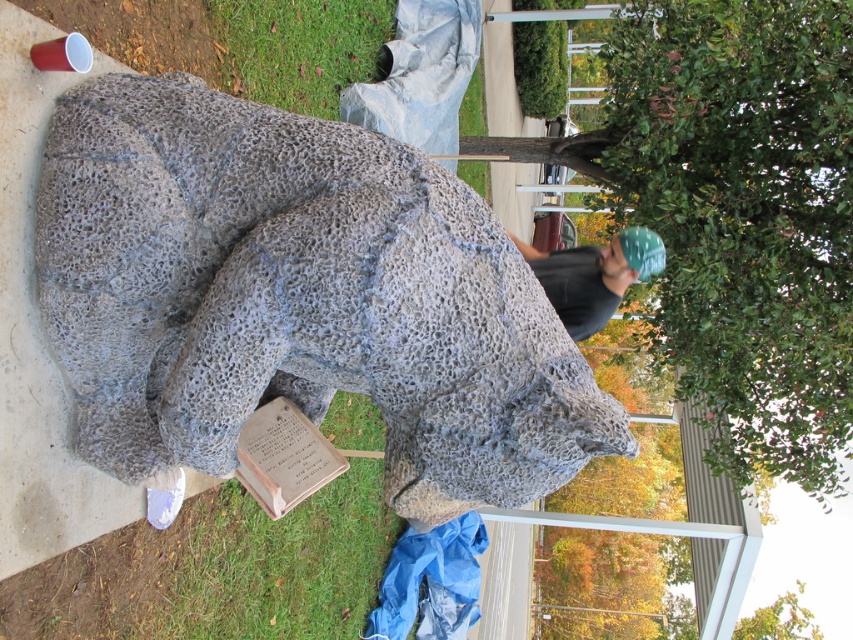
Based on the photo, who is more distant from viewer, (213,548) or (303,460)?

The point (213,548) is more distant.

Consider the image. Who is positioned more to the right, green grass at lower center or brown stone plaque at lower center?

brown stone plaque at lower center is more to the right.

Is point (288, 628) farther from camera compared to point (263, 419)?

Yes, point (288, 628) is behind point (263, 419).

The image size is (853, 640). I want to click on green grass at lower center, so click(x=279, y=564).

Which is more to the left, gray textured sculpture at center or dark gray textured fabric at center?

Positioned to the left is gray textured sculpture at center.

Is gray textured sculpture at center thinner than dark gray textured fabric at center?

No, gray textured sculpture at center is not thinner than dark gray textured fabric at center.

Is point (109, 324) farther from viewer compared to point (573, 314)?

No, (109, 324) is closer to viewer.

The width and height of the screenshot is (853, 640). I want to click on gray textured sculpture at center, so click(x=296, y=298).

Which is above, gray textured sculpture at center or green grass at lower center?

gray textured sculpture at center is higher up.

Is gray textured sculpture at center to the right of green grass at lower center from the viewer's perspective?

Indeed, gray textured sculpture at center is positioned on the right side of green grass at lower center.

Image resolution: width=853 pixels, height=640 pixels. In order to click on gray textured sculpture at center in this screenshot , I will do `click(296, 298)`.